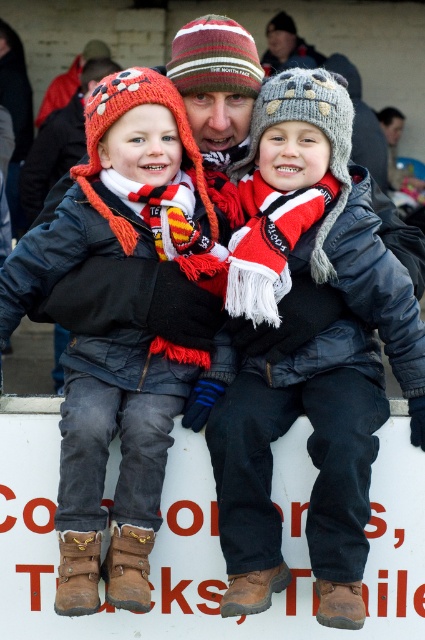
Between matte black jacket at center and knitted woolen hat at center, which one has less height?

With less height is knitted woolen hat at center.

Based on the photo, can you confirm if matte black jacket at center is wider than knitted woolen hat at center?

Incorrect, matte black jacket at center's width does not surpass knitted woolen hat at center's.

Which is behind, point (357, 349) or point (161, 205)?

The point (357, 349) is behind.

This screenshot has height=640, width=425. What are the coordinates of `matte black jacket at center` in the screenshot? It's located at (316, 365).